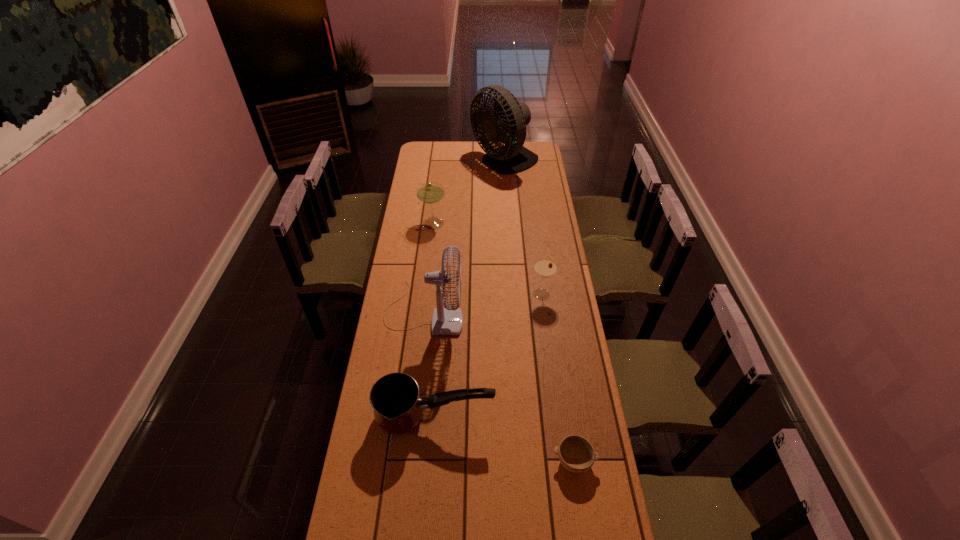
Where is `object that is the second nearest to the right martini`? The image size is (960, 540). object that is the second nearest to the right martini is located at coordinates coord(395,398).

Where is `vacant space that satisfies the following two spatial constraints: 1. in front of the farther fan to direct airflow; 2. on the front side of the left martini`? The width and height of the screenshot is (960, 540). vacant space that satisfies the following two spatial constraints: 1. in front of the farther fan to direct airflow; 2. on the front side of the left martini is located at coordinates (509, 224).

At what (x,y) coordinates should I click in order to perform the action: click on free location that satisfies the following two spatial constraints: 1. on the front side of the right martini; 2. on the front-facing side of the shorter fan. Please return your answer as a coordinate pair (x, y). The image size is (960, 540). Looking at the image, I should click on (544, 312).

This screenshot has width=960, height=540. Find the location of `free space that satisfies the following two spatial constraints: 1. on the handle side of the fifth farthest object; 2. on the back side of the shortest object`. free space that satisfies the following two spatial constraints: 1. on the handle side of the fifth farthest object; 2. on the back side of the shortest object is located at coordinates (432, 461).

Find the location of a particular element. The image size is (960, 540). free point that satisfies the following two spatial constraints: 1. on the front-facing side of the shorter fan; 2. on the back side of the shortest object is located at coordinates (407, 461).

Image resolution: width=960 pixels, height=540 pixels. I want to click on free space that satisfies the following two spatial constraints: 1. on the front-facing side of the left fan; 2. on the right side of the shortest object, so click(x=407, y=461).

I want to click on vacant position in the image that satisfies the following two spatial constraints: 1. on the handle side of the fifth farthest object; 2. on the right side of the nearest object, so click(x=432, y=461).